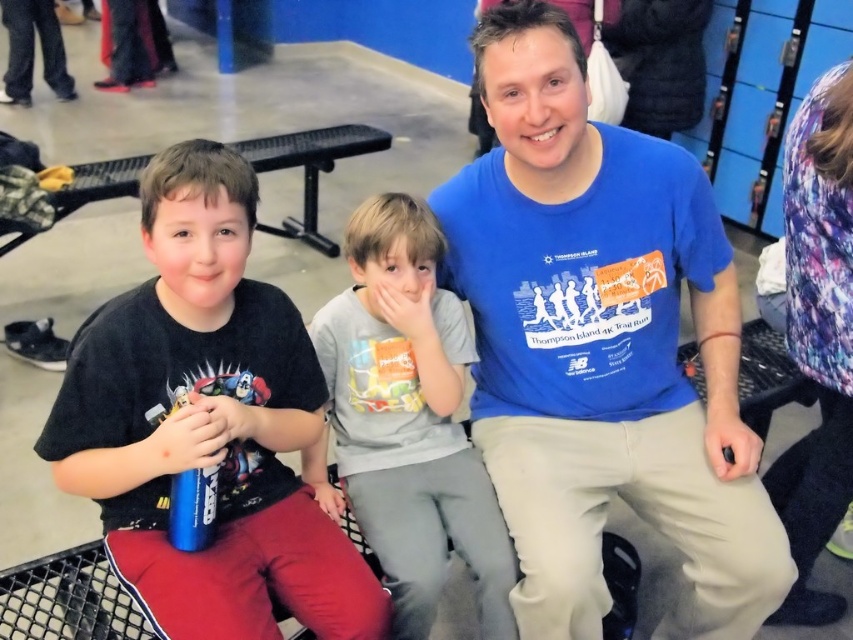
Does black matte shirt at left have a lesser height compared to gray cotton shirt at center?

Correct, black matte shirt at left is not as tall as gray cotton shirt at center.

In the scene shown: Does black matte shirt at left appear under gray cotton shirt at center?

Incorrect, black matte shirt at left is not positioned below gray cotton shirt at center.

Which is behind, point (131, 433) or point (421, 326)?

Point (421, 326)

Locate an element on the screen. black matte shirt at left is located at coordinates (206, 422).

Does blue cotton t-shirt at center have a greater height compared to black matte shirt at left?

Indeed, blue cotton t-shirt at center has a greater height compared to black matte shirt at left.

Does blue cotton t-shirt at center lie in front of black matte shirt at left?

No, it is not.

Who is more distant from viewer, (518, 220) or (164, 282)?

The point (518, 220) is behind.

The width and height of the screenshot is (853, 640). Find the location of `blue cotton t-shirt at center`. blue cotton t-shirt at center is located at coordinates (601, 346).

Is point (573, 339) behind point (445, 440)?

No.

Is point (683, 262) positioned in front of point (456, 312)?

Yes, point (683, 262) is in front of point (456, 312).

The width and height of the screenshot is (853, 640). What are the coordinates of `blue cotton t-shirt at center` in the screenshot? It's located at (601, 346).